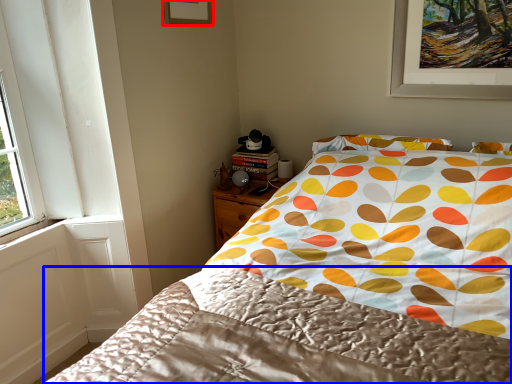
Question: Which object appears closest to the camera in this image, picture frame (highlighted by a red box) or blanket (highlighted by a blue box)?

Choices:
 (A) picture frame
 (B) blanket

Answer: (B)